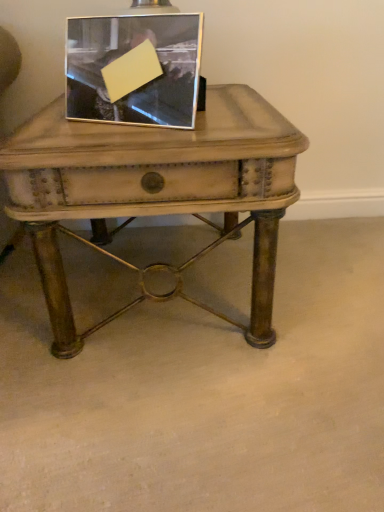
Locate an element on the screen. This screenshot has height=512, width=384. metallic silver picture frame at upper center is located at coordinates (134, 68).

This screenshot has width=384, height=512. What do you see at coordinates (134, 68) in the screenshot? I see `metallic silver picture frame at upper center` at bounding box center [134, 68].

Where is `matte wood table at center`? matte wood table at center is located at coordinates (154, 189).

What do you see at coordinates (154, 189) in the screenshot? I see `matte wood table at center` at bounding box center [154, 189].

Measure the distance between point (255, 209) and camera.

Point (255, 209) is 81.00 centimeters from camera.

Identify the location of metallic silver picture frame at upper center. Image resolution: width=384 pixels, height=512 pixels. (134, 68).

Considering the relative positions of matte wood table at center and metallic silver picture frame at upper center in the image provided, is matte wood table at center to the left of metallic silver picture frame at upper center from the viewer's perspective?

Incorrect, matte wood table at center is not on the left side of metallic silver picture frame at upper center.

Which is in front, matte wood table at center or metallic silver picture frame at upper center?

matte wood table at center is in front.

Which point is more distant from viewer, (46, 279) or (144, 33)?

The point (46, 279) is farther.

From the image's perspective, between matte wood table at center and metallic silver picture frame at upper center, who is located below?

matte wood table at center is shown below in the image.

From a real-world perspective, is matte wood table at center beneath metallic silver picture frame at upper center?

Yes, from a real-world perspective, matte wood table at center is beneath metallic silver picture frame at upper center.

Considering the relative sizes of matte wood table at center and metallic silver picture frame at upper center in the image provided, is matte wood table at center wider than metallic silver picture frame at upper center?

Correct, the width of matte wood table at center exceeds that of metallic silver picture frame at upper center.

Who is shorter, matte wood table at center or metallic silver picture frame at upper center?

metallic silver picture frame at upper center.

Does matte wood table at center have a larger size compared to metallic silver picture frame at upper center?

Yes, matte wood table at center is bigger than metallic silver picture frame at upper center.

Is matte wood table at center outside of metallic silver picture frame at upper center?

Yes.

From the picture: Would you say matte wood table at center is a long distance from metallic silver picture frame at upper center?

No, matte wood table at center is not far away from metallic silver picture frame at upper center.

Is matte wood table at center facing towards metallic silver picture frame at upper center?

No, matte wood table at center is not oriented towards metallic silver picture frame at upper center.

In order to click on picture frame located above the matte wood table at center (from a real-world perspective) in this screenshot , I will do `click(134, 68)`.

Considering the relative positions of metallic silver picture frame at upper center and matte wood table at center in the image provided, is metallic silver picture frame at upper center to the left or to the right of matte wood table at center?

metallic silver picture frame at upper center is to the left of matte wood table at center.

Is the depth of metallic silver picture frame at upper center less than that of matte wood table at center?

No, metallic silver picture frame at upper center is behind matte wood table at center.

Which is less distant, (173, 124) or (262, 215)?

Point (173, 124) is closer to the camera than point (262, 215).

From the image's perspective, which is below, metallic silver picture frame at upper center or matte wood table at center?

matte wood table at center.

From a real-world perspective, is metallic silver picture frame at upper center located beneath matte wood table at center?

Incorrect, from a real-world perspective, metallic silver picture frame at upper center is higher than matte wood table at center.

Is metallic silver picture frame at upper center wider or thinner than matte wood table at center?

In the image, metallic silver picture frame at upper center appears to be more narrow than matte wood table at center.

In terms of height, does metallic silver picture frame at upper center look taller or shorter compared to matte wood table at center?

Considering their sizes, metallic silver picture frame at upper center has less height than matte wood table at center.

Based on their sizes in the image, would you say metallic silver picture frame at upper center is bigger or smaller than matte wood table at center?

Clearly, metallic silver picture frame at upper center is smaller in size than matte wood table at center.

Is matte wood table at center completely or partially inside metallic silver picture frame at upper center?

That's incorrect, matte wood table at center is not inside metallic silver picture frame at upper center.

Would you consider metallic silver picture frame at upper center to be distant from matte wood table at center?

No, metallic silver picture frame at upper center is not far from matte wood table at center.

Is metallic silver picture frame at upper center oriented towards matte wood table at center?

No.

Locate an element on the screen. Image resolution: width=384 pixels, height=512 pixels. table that is on the right side of metallic silver picture frame at upper center is located at coordinates (154, 189).

Identify the location of picture frame behind the matte wood table at center. This screenshot has height=512, width=384. (134, 68).

Locate an element on the screen. table on the right of metallic silver picture frame at upper center is located at coordinates (154, 189).